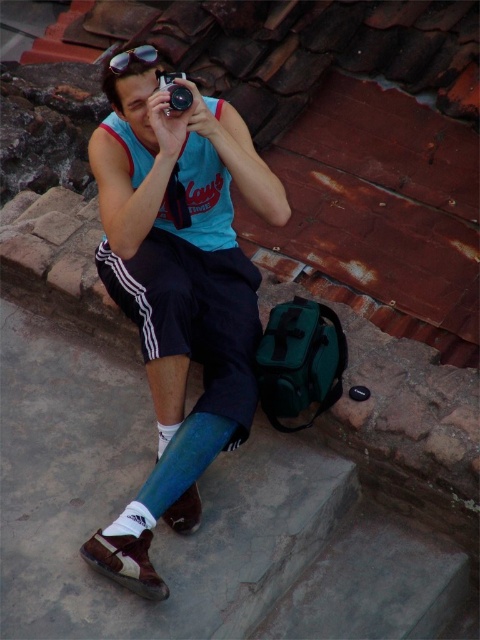
You are a photographer trying to capture a unique angle of the scene. You have the black plastic camera at center and the shiny plastic goggles at upper center. Which object is positioned higher in the image?

The shiny plastic goggles at upper center are positioned higher in the image than the black plastic camera at center.

You are a photographer trying to capture a candid shot of the person sitting on the stone ledge. You notice the blue fabric shorts at center and the black plastic camera at center. Which object should you focus on first if you want to capture the subject holding the camera in the foreground?

The black plastic camera at center should be focused on first since it is positioned above the blue fabric shorts at center, making it closer to the foreground.